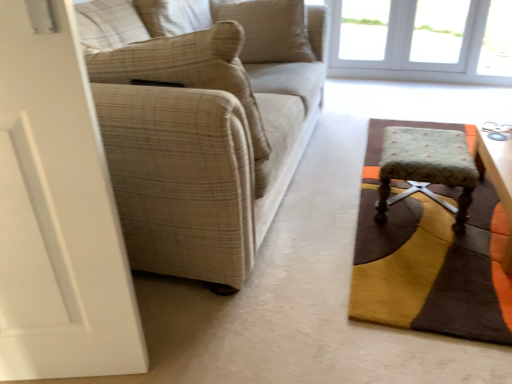
The image size is (512, 384). I want to click on vacant region to the left of wooden round table at right, so click(x=417, y=244).